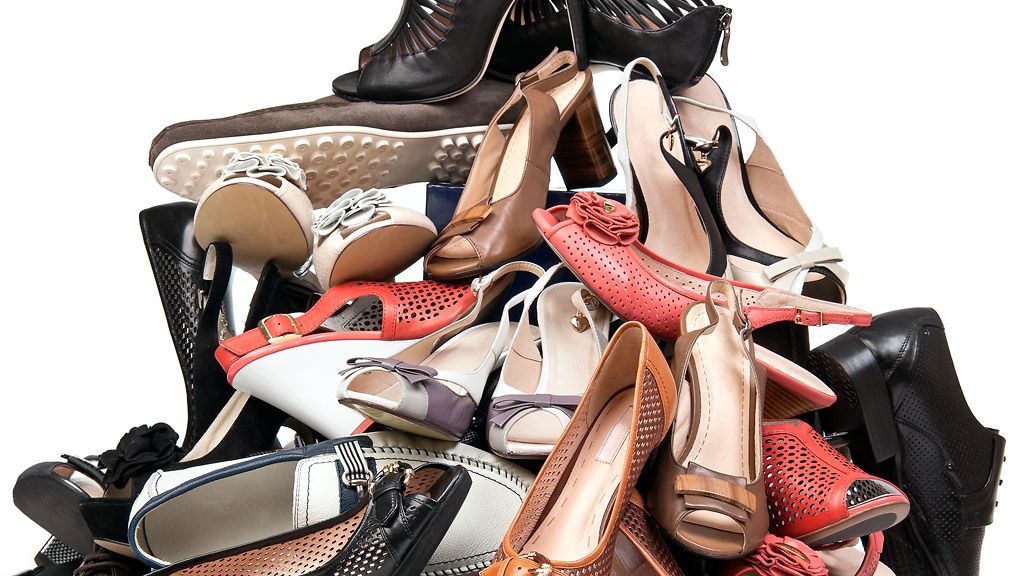
Where is `floral embellishments`? This screenshot has width=1024, height=576. floral embellishments is located at coordinates (790, 558), (141, 446), (284, 170), (348, 209), (602, 214).